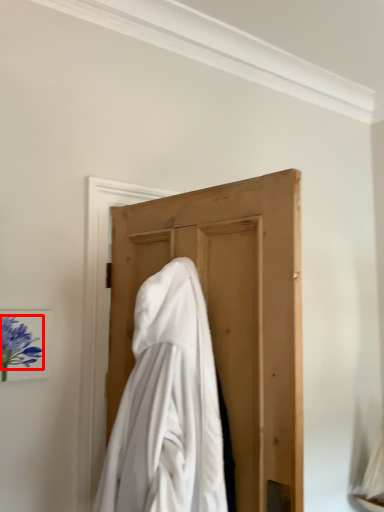
Question: From the image, what is the correct spatial relationship of flower (annotated by the red box) in relation to cloak?

Choices:
 (A) left
 (B) right

Answer: (A)